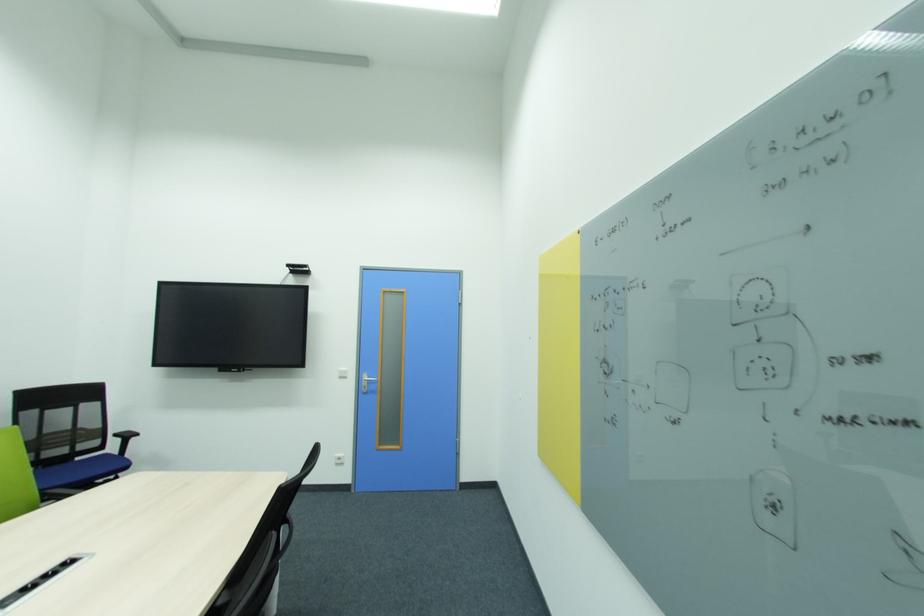
Identify the location of blue chair sitting surface. (80, 471).